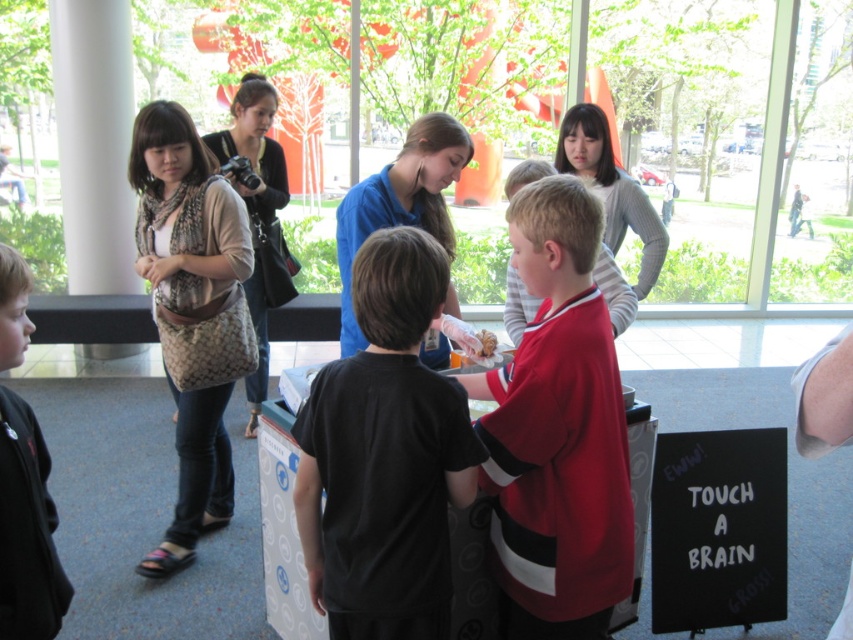
You are a visitor at the museum and want to take a photo of the black chalkboard at lower right and the blue smooth shirt at center. Which object should you focus on first to ensure both are in the frame?

The black chalkboard at lower right is wider than the blue smooth shirt at center, so focus on the black chalkboard at lower right first to ensure both fit in the frame.

You are a visitor at the museum and want to touch the brain exhibit. The exhibit is located at the point with coordinates (556, 432) on the table. Where exactly on the table should you reach to touch the brain?

The point at coordinates (556, 432) corresponds to the red matte jersey at center, so you should reach for the red matte jersey at center to touch the brain.

What is the exact location of the red matte jersey at center in the image?

The red matte jersey at center is located at point coordinates of (556, 432).